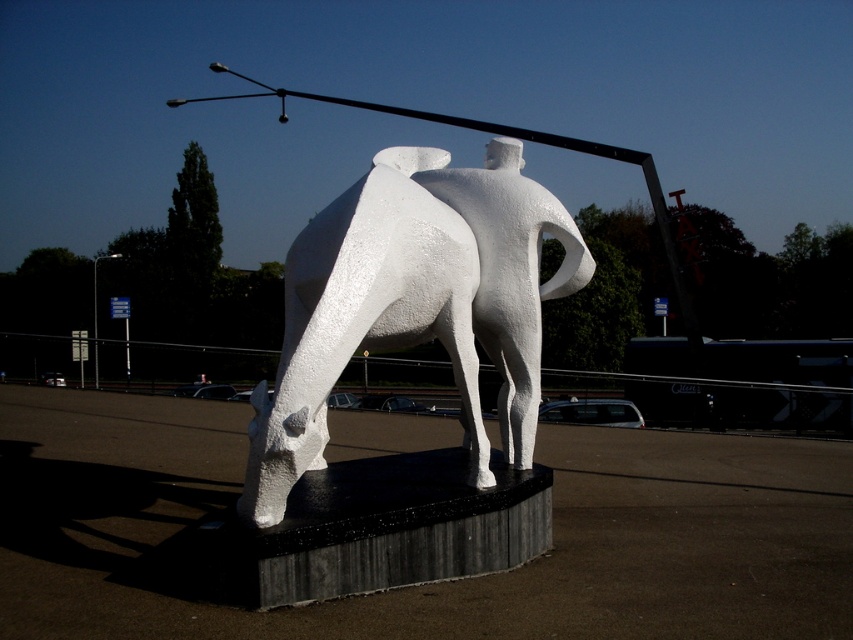
Is white matte sculpture at center in front of metallic pole at left?

Yes, white matte sculpture at center is closer to the viewer.

Where is `white matte sculpture at center`? white matte sculpture at center is located at coordinates (415, 301).